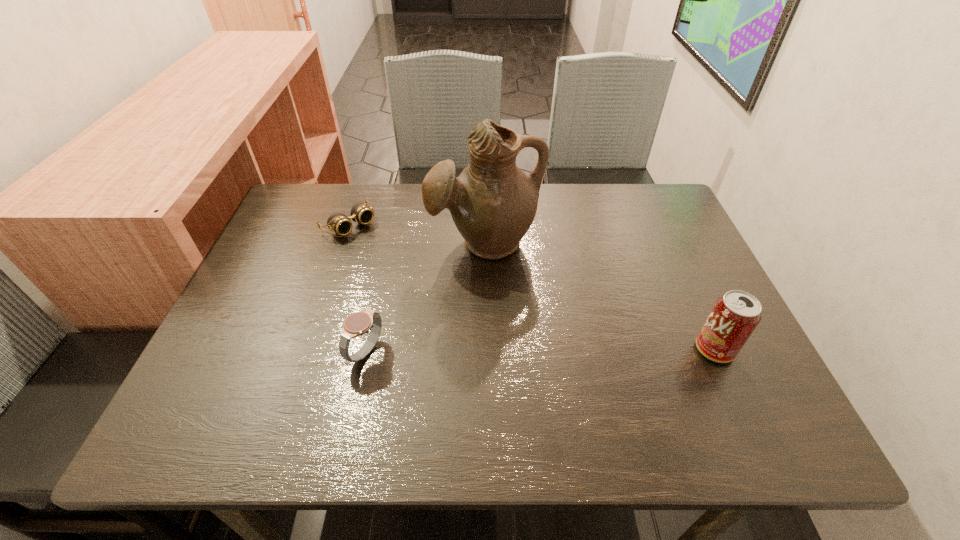
Identify which object is the third closest to the goggles. Please provide its 2D coordinates. Your answer should be formatted as a tuple, i.e. [(x, y)], where the tuple contains the x and y coordinates of a point satisfying the conditions above.

[(735, 315)]

Identify which object is located as the second nearest to the shortest object. Please provide its 2D coordinates. Your answer should be formatted as a tuple, i.e. [(x, y)], where the tuple contains the x and y coordinates of a point satisfying the conditions above.

[(358, 323)]

The image size is (960, 540). In order to click on vacant region that satisfies the following two spatial constraints: 1. on the front side of the soda can; 2. on the left side of the shortest object in this screenshot , I will do `click(307, 349)`.

Where is `free point that satisfies the following two spatial constraints: 1. on the front side of the shortest object; 2. on the right side of the second tallest object`? This screenshot has height=540, width=960. free point that satisfies the following two spatial constraints: 1. on the front side of the shortest object; 2. on the right side of the second tallest object is located at coordinates (307, 349).